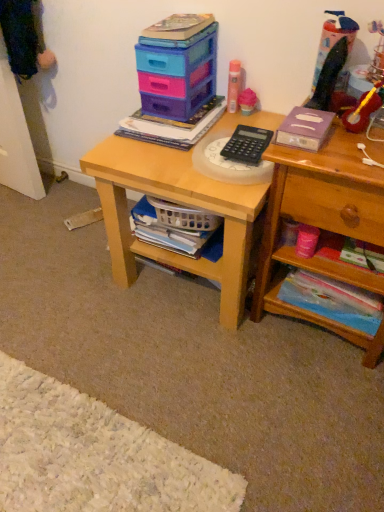
I want to click on free space above light wood desk at center (from a real-world perspective), so click(184, 143).